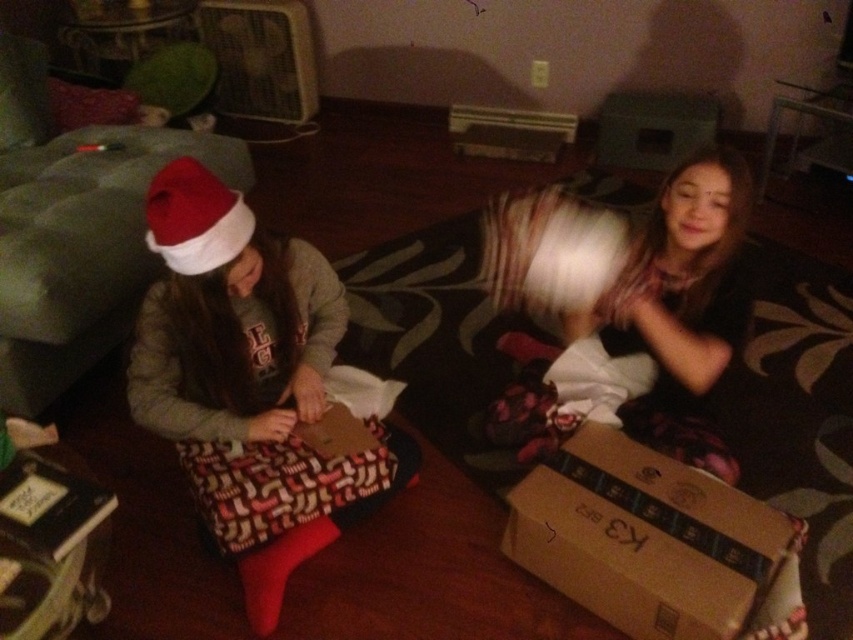
You are organizing a holiday gift exchange and need to place the matte black gift at left and brown cardboard box at lower right on a shelf. According to the scene, which object should be placed on the left side of the shelf?

The matte black gift at left should be placed on the left side of the shelf since it is positioned to the left of the brown cardboard box at lower right in the scene.

You are standing in the room and want to reach both points. Which point, point (230, 323) or point (729, 566), is closer to you?

Point (230, 323) is closer to you because it is further to the viewer than point (729, 566).